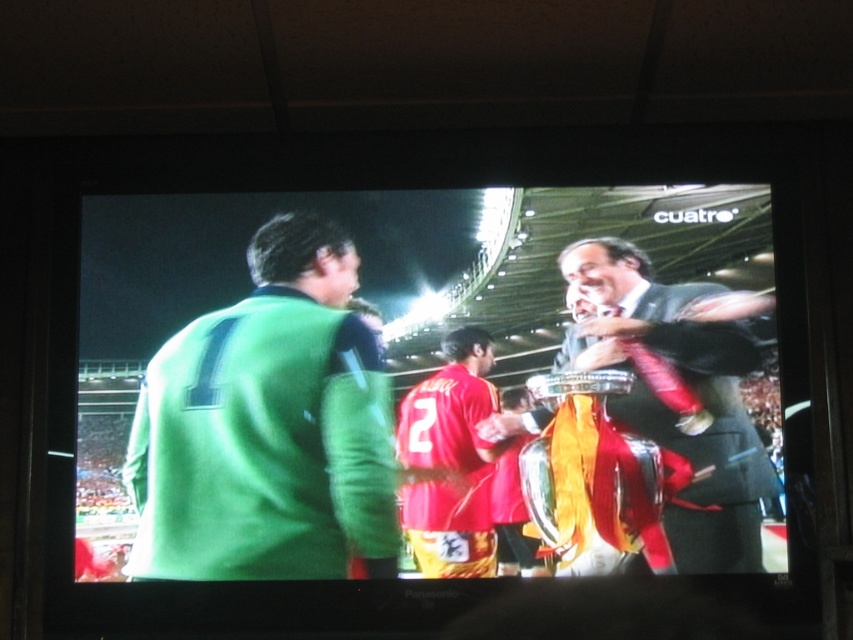
Question: Does shiny black suit at center lie behind red jersey at center?

Choices:
 (A) no
 (B) yes

Answer: (A)

Question: Is green jersey at center wider than shiny black suit at center?

Choices:
 (A) yes
 (B) no

Answer: (A)

Question: Which object appears closest to the camera in this image?

Choices:
 (A) red jersey at center
 (B) green jersey at center

Answer: (A)

Question: Which is farther from the red jersey at center?

Choices:
 (A) green jersey at center
 (B) shiny black suit at center

Answer: (B)

Question: Which point appears closest to the camera in this image?

Choices:
 (A) (296, 544)
 (B) (578, 330)
 (C) (457, 563)

Answer: (C)

Question: Can you confirm if green jersey at center is positioned to the left of red jersey at center?

Choices:
 (A) no
 (B) yes

Answer: (B)